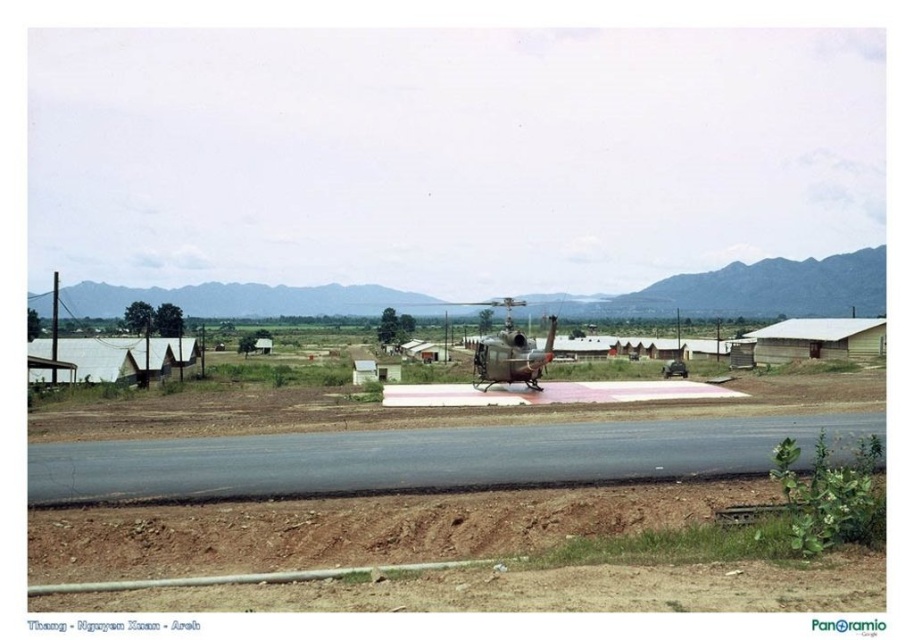
You are a drone operator planning to land a drone on the black asphalt runway at center. The drone has a maximum flight range of 60 meters. Can the drone reach the runway from your current position?

The black asphalt runway at center and camera are 65.74 meters apart from each other. Since the drone has a maximum flight range of 60 meters, it cannot reach the runway from the current position.

You are a drone operator trying to land a drone on the black asphalt runway at center. According to the coordinates provided, where exactly should you aim to land the drone?

You should aim for the coordinates point at (428, 458) on the black asphalt runway at center.

You are a pilot preparing to land a small aircraft. You see the black asphalt runway at center and the metallic green helicopter at center in the image. Which object is located to the left of the other?

The black asphalt runway at center is positioned on the left side of metallic green helicopter at center, so the runway is to the left of the helicopter.